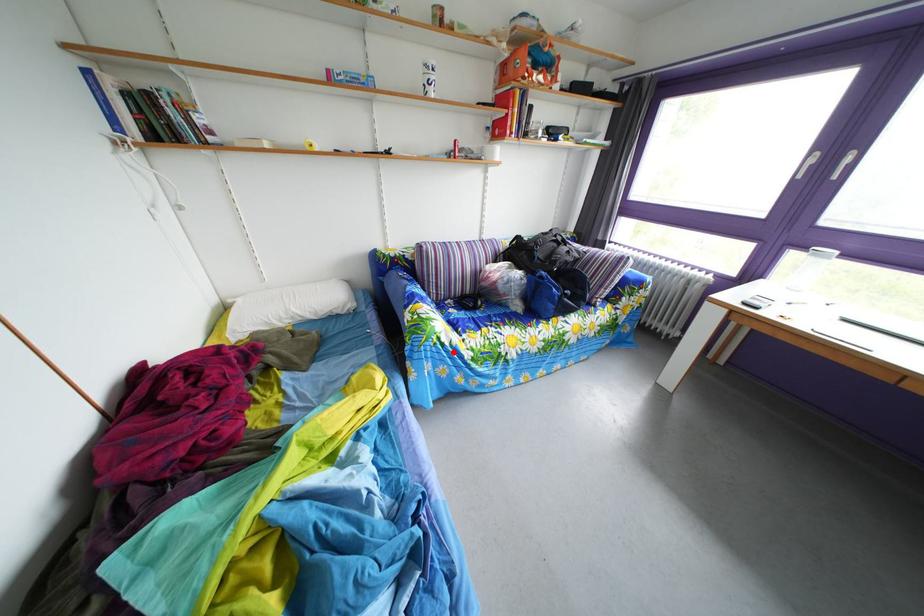
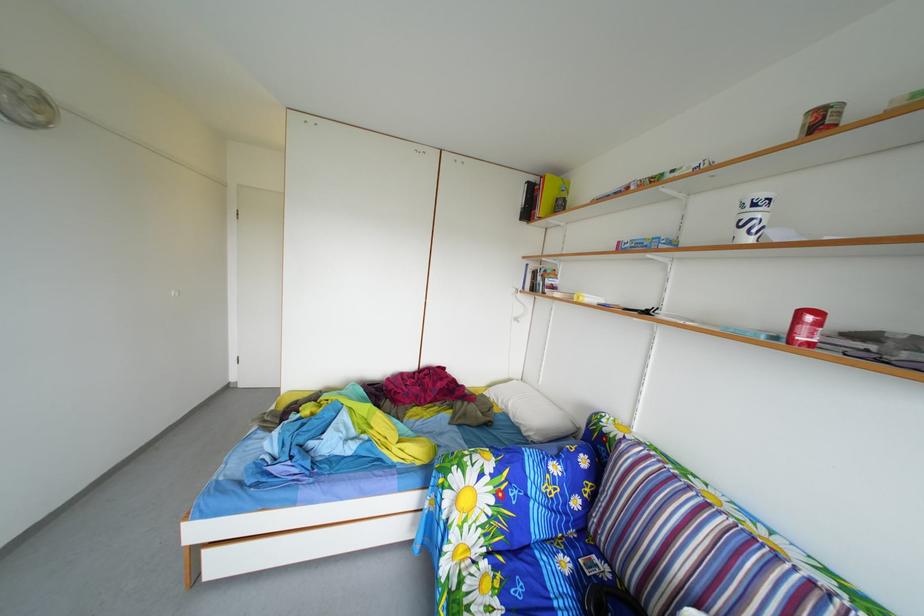
Question: I am providing you with two images of the same scene from different viewpoints. Given a red point in image1, look at the same physical point in image2. Is it:

Choices:
 (A) Closer to the viewpoint
 (B) Farther from the viewpoint

Answer: (B)